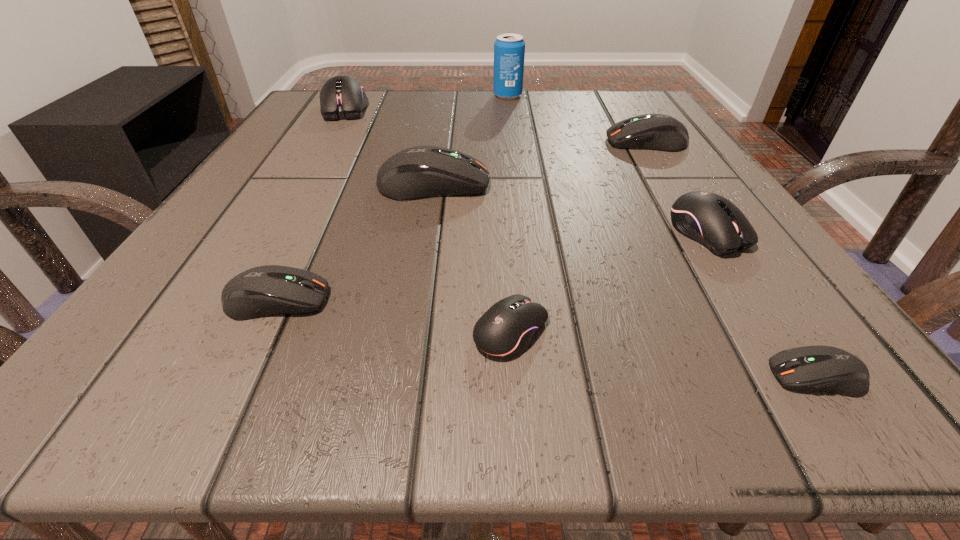
Where is `vacant space in between the sixth nearest object and the shortest object`? vacant space in between the sixth nearest object and the shortest object is located at coordinates (732, 259).

Where is `free spot between the third nearest dark computer equipment and the farthest dark computer equipment`? This screenshot has width=960, height=540. free spot between the third nearest dark computer equipment and the farthest dark computer equipment is located at coordinates (540, 164).

Locate an element on the screen. Image resolution: width=960 pixels, height=540 pixels. free space between the leftmost black computer mouse and the leftmost dark computer equipment is located at coordinates (310, 204).

Find the location of `free space between the biggest black computer mouse and the second farthest computer equipment`. free space between the biggest black computer mouse and the second farthest computer equipment is located at coordinates (495, 125).

At what (x,y) coordinates should I click in order to perform the action: click on vacant region between the shortest object and the farthest dark computer equipment. Please return your answer as a coordinate pair (x, y). This screenshot has height=540, width=960. Looking at the image, I should click on (732, 259).

Locate an element on the screen. vacant region between the soda can and the third farthest computer equipment is located at coordinates (470, 140).

This screenshot has width=960, height=540. What are the coordinates of `free space between the blue soda can and the second smallest black computer mouse` in the screenshot? It's located at (608, 164).

Locate an element on the screen. Image resolution: width=960 pixels, height=540 pixels. empty space between the second nearest dark computer equipment and the shortest computer equipment is located at coordinates (546, 338).

The height and width of the screenshot is (540, 960). Identify the location of object that is the second closest to the rightmost black computer mouse. (659, 132).

Where is `object that is the fifth nearest to the tallest object`? Image resolution: width=960 pixels, height=540 pixels. object that is the fifth nearest to the tallest object is located at coordinates (262, 291).